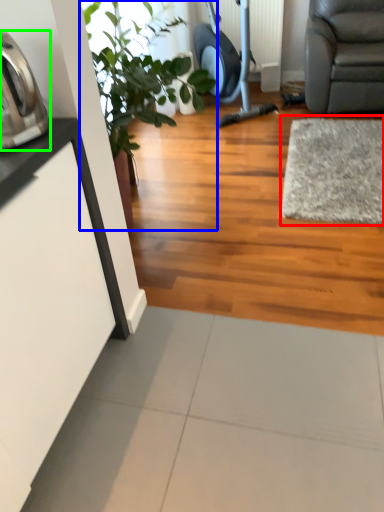
Question: Which object is positioned closest to mat (highlighted by a red box)? Select from houseplant (highlighted by a blue box) and appliance (highlighted by a green box).

Choices:
 (A) houseplant
 (B) appliance

Answer: (A)